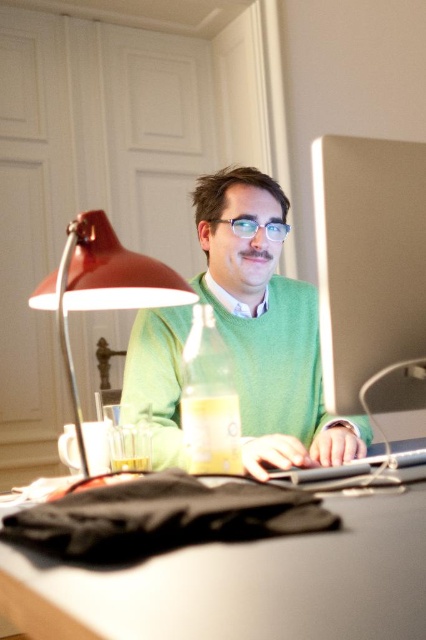
Question: Is black matte table at lower center positioned behind green matte sweater at center?

Choices:
 (A) no
 (B) yes

Answer: (A)

Question: Estimate the real-world distances between objects in this image. Which object is closer to the black matte table at lower center?

Choices:
 (A) translucent yellow bottle at center
 (B) matte red desk lamp at left
 (C) green matte sweater at center

Answer: (A)

Question: Considering the real-world distances, which object is farthest from the yellow paper cup at lower center?

Choices:
 (A) translucent glass beverage at desk center
 (B) sleek silver laptop at center
 (C) translucent yellow bottle at center

Answer: (B)

Question: Is translucent yellow bottle at center to the left of translucent glass beverage at desk center from the viewer's perspective?

Choices:
 (A) yes
 (B) no

Answer: (B)

Question: Does green matte sweater at center lie in front of sleek silver laptop at center?

Choices:
 (A) no
 (B) yes

Answer: (A)

Question: Based on their relative distances, which object is farther from the translucent glass beverage at desk center?

Choices:
 (A) black matte table at lower center
 (B) translucent yellow bottle at center

Answer: (A)